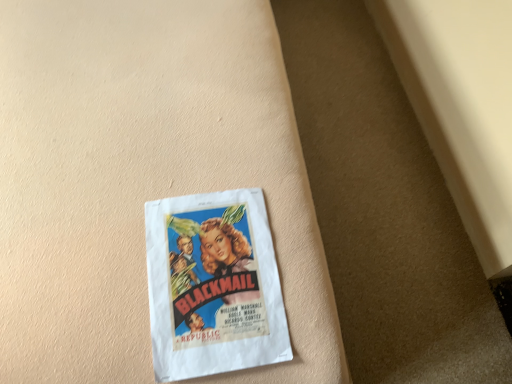
Where is `vacant space situated above white paper poster at center (from a real-world perspective)`? vacant space situated above white paper poster at center (from a real-world perspective) is located at coordinates (192, 263).